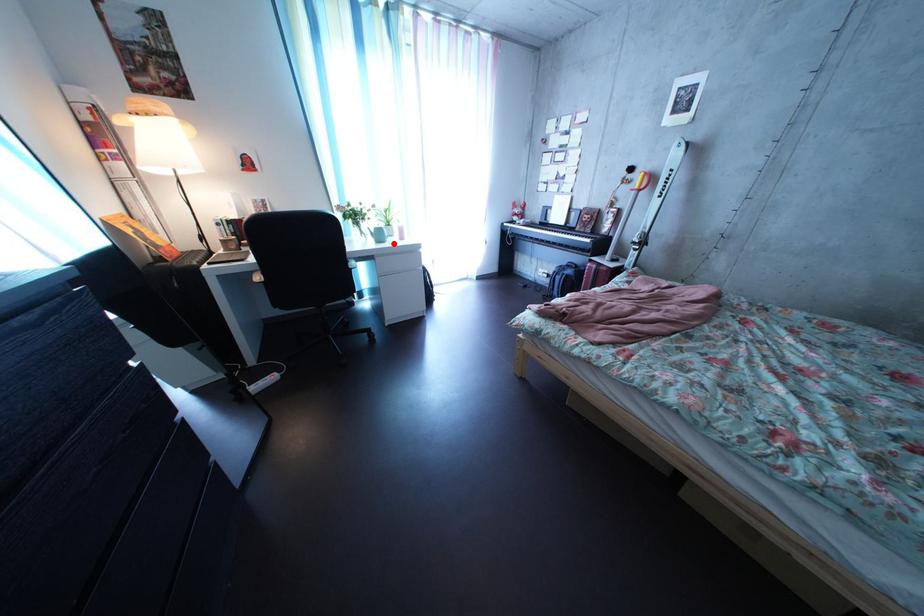
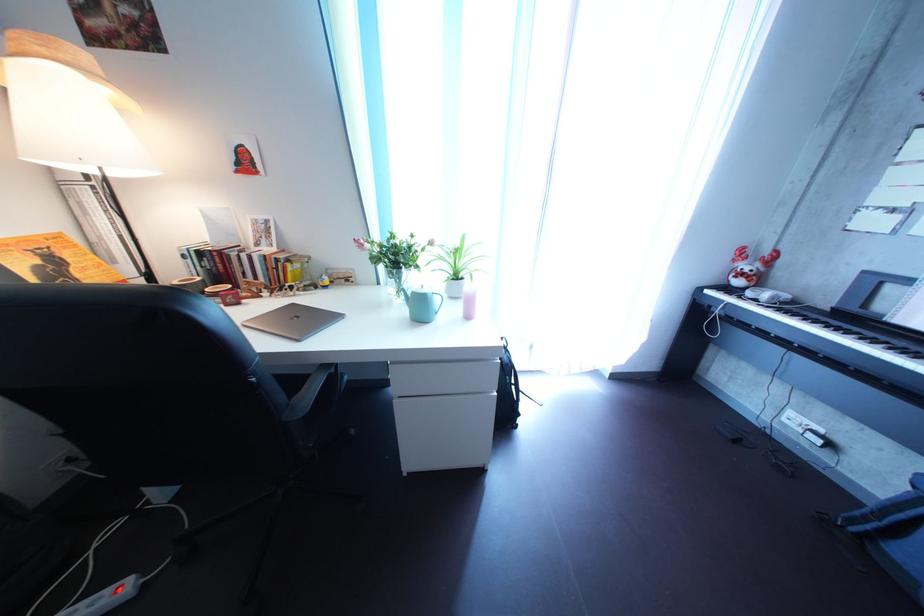
Question: I am providing you with two images of the same scene from different viewpoints. Given a red point in image1, look at the same physical point in image2. Is it:

Choices:
 (A) Closer to the viewpoint
 (B) Farther from the viewpoint

Answer: (B)